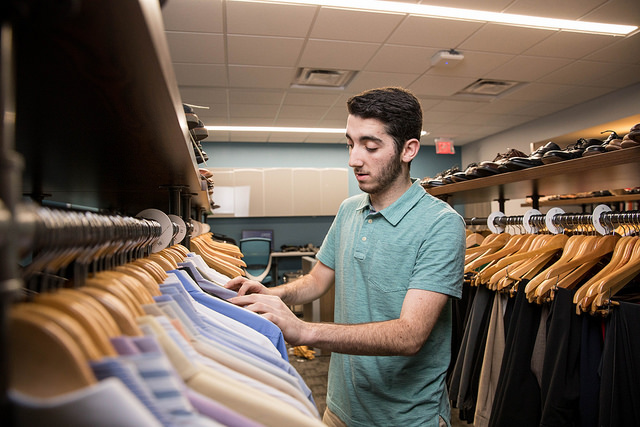
This screenshot has width=640, height=427. What are the coordinates of `chair` in the screenshot? It's located at (x=262, y=248).